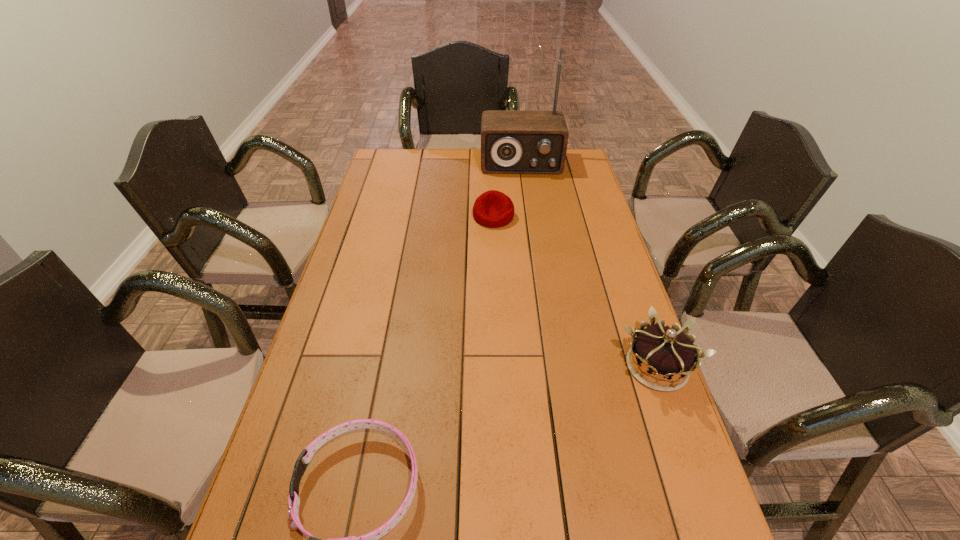
Where is `crown`? The width and height of the screenshot is (960, 540). crown is located at coordinates (664, 352).

Find the location of a particular element. The width and height of the screenshot is (960, 540). the rightmost object is located at coordinates (664, 352).

Identify the location of the second farthest object. (493, 209).

Identify the location of the third tallest object. The width and height of the screenshot is (960, 540). (493, 209).

The width and height of the screenshot is (960, 540). I want to click on radio receiver, so click(x=512, y=141).

Where is `the tallest object`? the tallest object is located at coordinates (512, 141).

Locate an element on the screen. Image resolution: width=960 pixels, height=540 pixels. vacant space located 0.270m on the front of the crown is located at coordinates (713, 527).

At what (x,y) coordinates should I click in order to perform the action: click on vacant space situated 0.180m on the seat area of the beanbag. Please return your answer as a coordinate pair (x, y). Image resolution: width=960 pixels, height=540 pixels. Looking at the image, I should click on (500, 262).

Identify the location of blank space located 0.330m on the seat area of the beanbag. (505, 295).

Locate an element on the screen. This screenshot has height=540, width=960. vacant space situated 0.080m on the seat area of the beanbag is located at coordinates (497, 243).